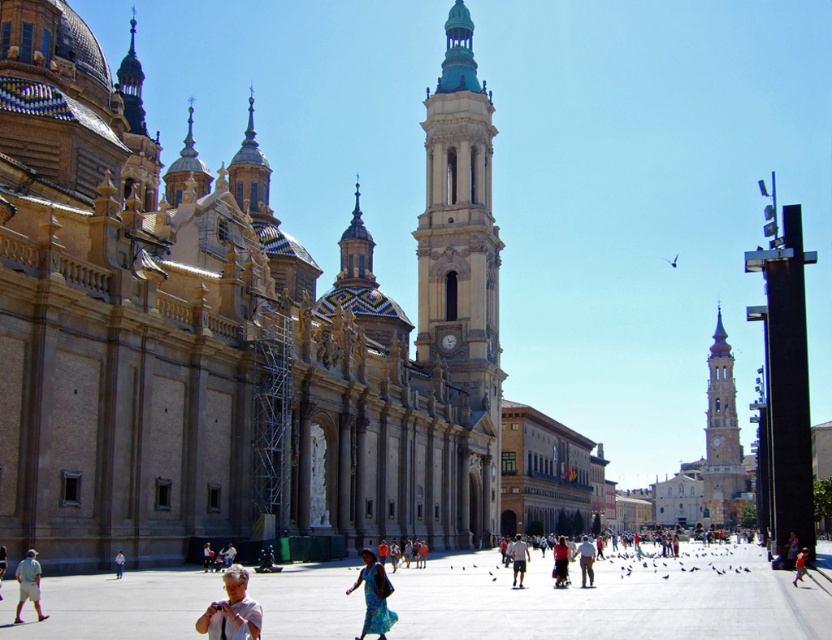
Question: Is smooth stone clock tower at center positioned before dark red fabric dress at center?

Choices:
 (A) yes
 (B) no

Answer: (B)

Question: Among these objects, which one is nearest to the camera?

Choices:
 (A) dark red fabric dress at center
 (B) light brown shorts at center
 (C) matte white shirt at lower center

Answer: (C)

Question: Where is smooth concrete plaza at center located in relation to smooth stone clock tower at center in the image?

Choices:
 (A) above
 (B) below

Answer: (B)

Question: Which point is closer to the camera taking this photo?

Choices:
 (A) (x=367, y=602)
 (B) (x=627, y=589)
 (C) (x=172, y=548)
 (D) (x=568, y=554)

Answer: (A)

Question: Is beige stone church at center positioned behind light brown shorts at center?

Choices:
 (A) no
 (B) yes

Answer: (A)

Question: Which point appears farthest from the camera in this image?

Choices:
 (A) (717, 465)
 (B) (93, 285)
 (C) (523, 541)

Answer: (A)